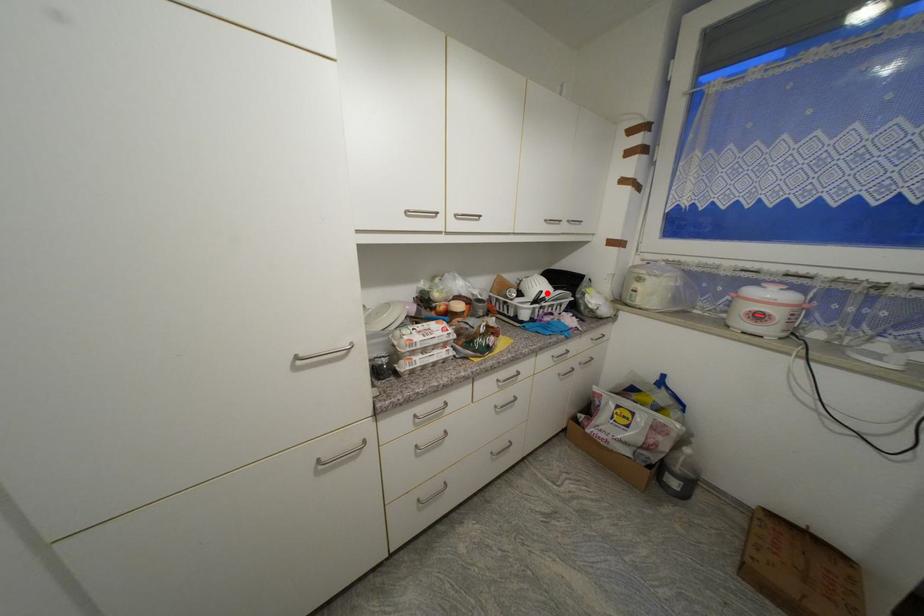
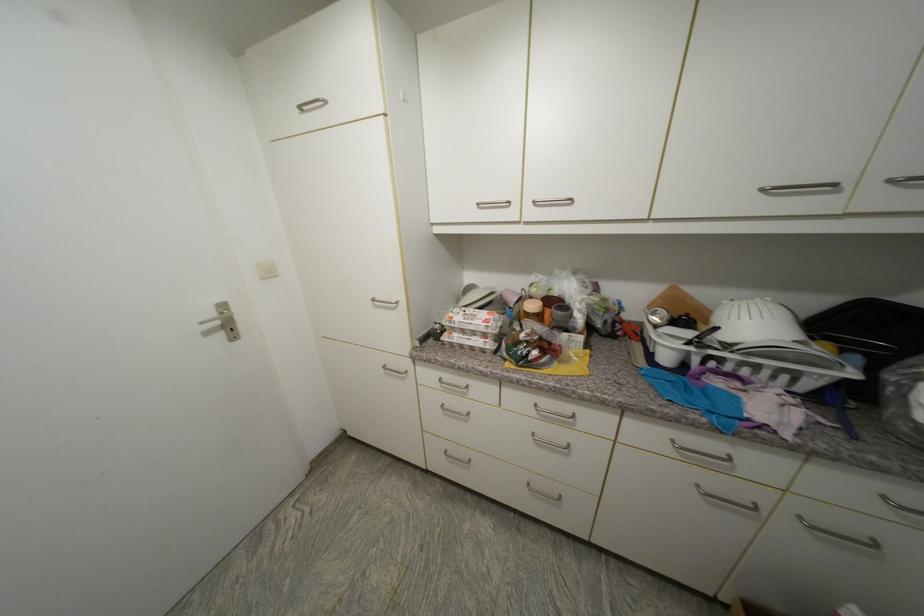
Where in the second image is the point corresponding to the highlighted location from the first image?

(723, 330)